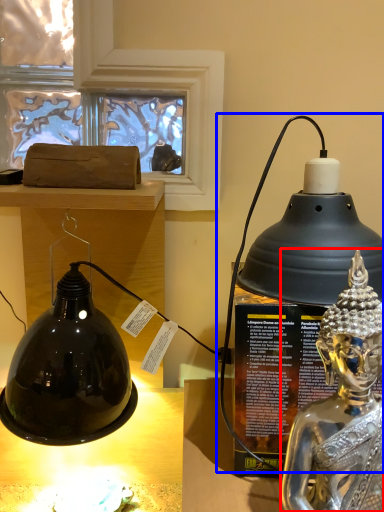
Question: Which object is closer to the camera taking this photo, person (highlighted by a red box) or oil lamp (highlighted by a blue box)?

Choices:
 (A) person
 (B) oil lamp

Answer: (A)